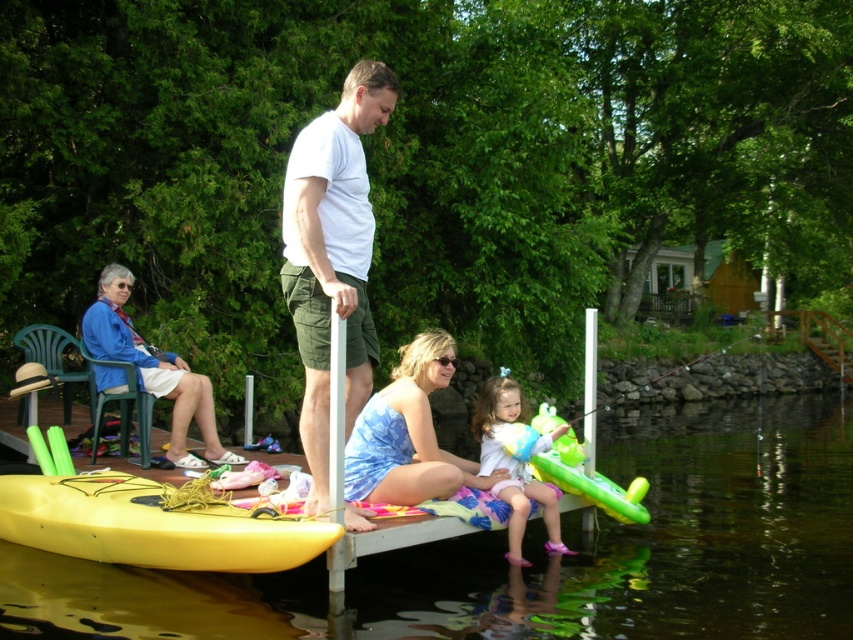
Question: Based on their relative distances, which object is nearer to the blue tie-dye dress at center?

Choices:
 (A) green inflatable float at lower right
 (B) white matte shirt at center
 (C) transparent plastic water at lower center
 (D) white fabric dress at lower center

Answer: (D)

Question: Does transparent plastic water at lower center appear on the right side of yellow plastic canoe at lower left?

Choices:
 (A) no
 (B) yes

Answer: (B)

Question: Is transparent plastic water at lower center above white matte shirt at center?

Choices:
 (A) no
 (B) yes

Answer: (A)

Question: Among these objects, which one is nearest to the camera?

Choices:
 (A) white fabric dress at lower center
 (B) white matte shirt at center
 (C) green inflatable float at lower right

Answer: (B)

Question: Is yellow plastic canoe at lower left to the right of green inflatable float at lower right from the viewer's perspective?

Choices:
 (A) yes
 (B) no

Answer: (B)

Question: Which point appears closest to the camera in this image?

Choices:
 (A) (547, 410)
 (B) (500, 372)
 (C) (90, 524)
 (D) (88, 632)

Answer: (D)